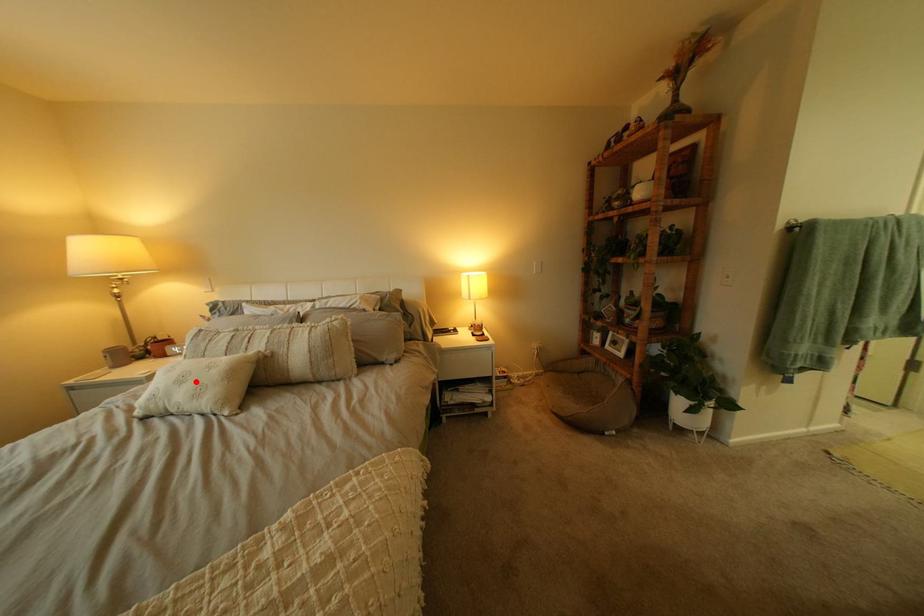
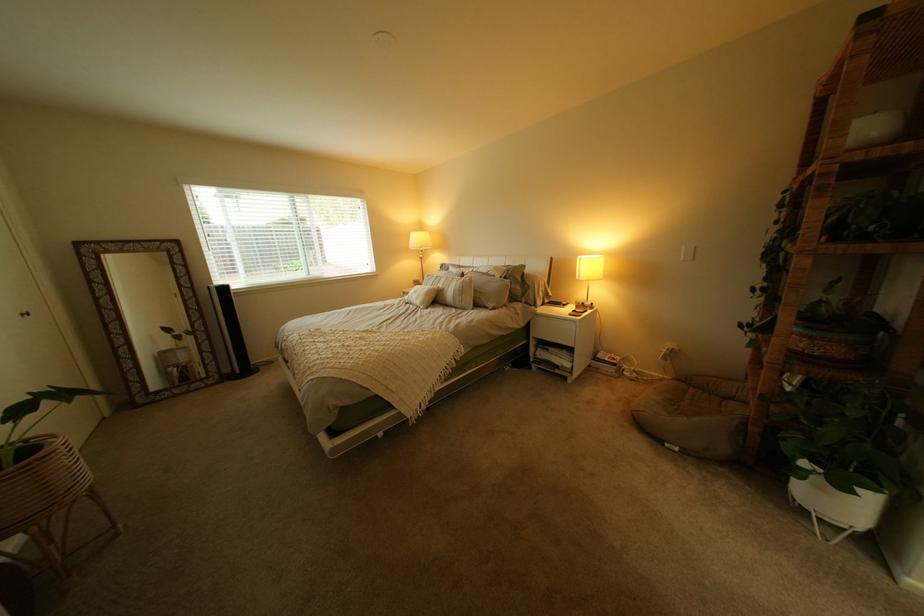
In the second image, find the point that corresponds to the highlighted location in the first image.

(431, 293)